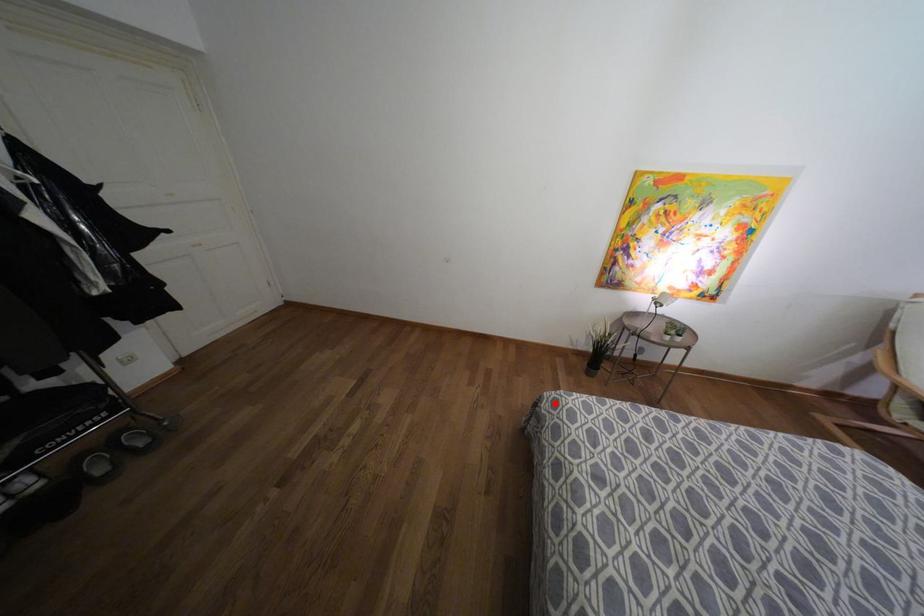
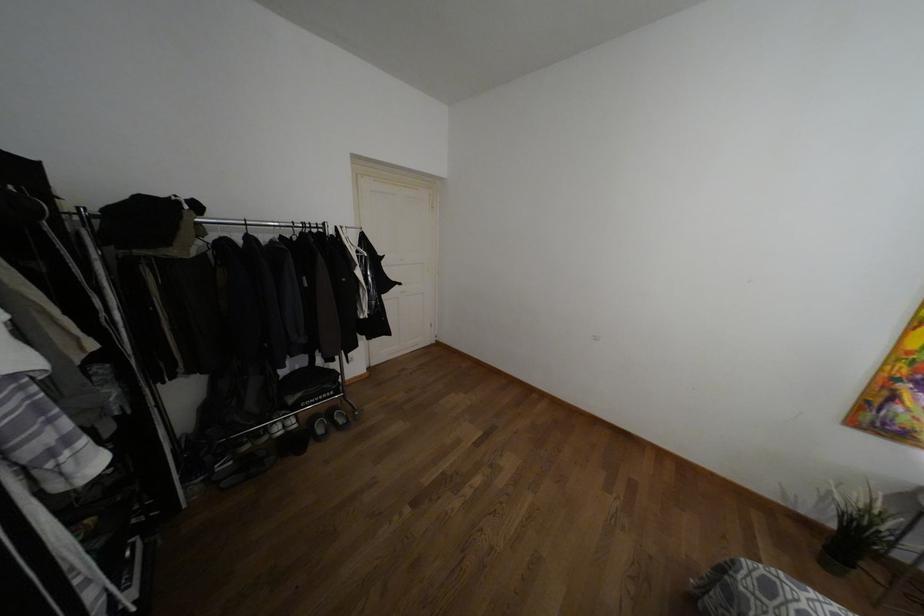
Question: I am providing you with two images of the same scene from different viewpoints. In image1, a red point is highlighted. Considering the same 3D point in image2, which of the following is correct?

Choices:
 (A) It is closer
 (B) It is farther

Answer: (B)